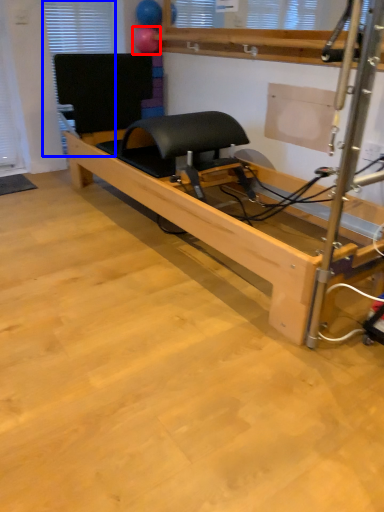
Question: Among these objects, which one is farthest to the camera, balloon (highlighted by a red box) or window (highlighted by a blue box)?

Choices:
 (A) balloon
 (B) window

Answer: (A)